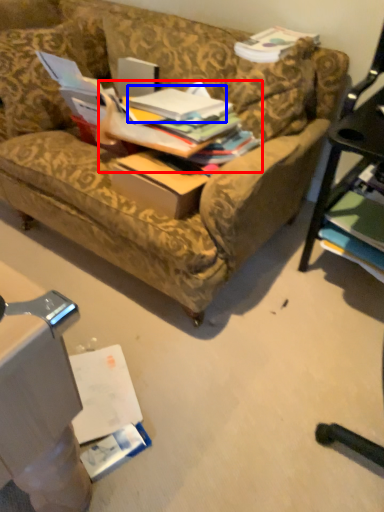
Question: Which of the following is the closest to the observer, book (highlighted by a red box) or book (highlighted by a blue box)?

Choices:
 (A) book
 (B) book

Answer: (A)